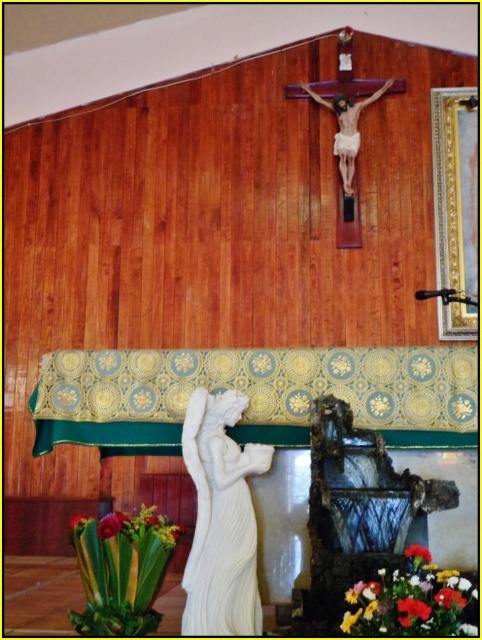
Between white marble statue at center and vivid red petals at lower right, which one appears on the left side from the viewer's perspective?

Positioned to the left is white marble statue at center.

Is white marble statue at center taller than vivid red petals at lower right?

Indeed, white marble statue at center has a greater height compared to vivid red petals at lower right.

Does point (239, 516) come closer to viewer compared to point (450, 602)?

No, (239, 516) is further to viewer.

You are a GUI agent. You are given a task and a screenshot of the screen. Output one action in this format:
    pyautogui.click(x=<x>, y=<y>)
    Task: Click on the white marble statue at center
    
    Given the screenshot: What is the action you would take?
    pyautogui.click(x=221, y=518)

Is point (119, 515) closer to viewer compared to point (444, 602)?

No, (119, 515) is behind (444, 602).

Can you confirm if green leafy plant at lower left is bigger than vivid red petals at lower right?

Correct, green leafy plant at lower left is larger in size than vivid red petals at lower right.

Where is `green leafy plant at lower left`? green leafy plant at lower left is located at coordinates (110, 524).

Is the position of vibrant floral bouquet at lower right more distant than that of green leafy plant at lower left?

No, vibrant floral bouquet at lower right is in front of green leafy plant at lower left.

The height and width of the screenshot is (640, 482). I want to click on vibrant floral bouquet at lower right, so click(x=411, y=604).

Where is `vibrant floral bouquet at lower right`? This screenshot has width=482, height=640. vibrant floral bouquet at lower right is located at coordinates (411, 604).